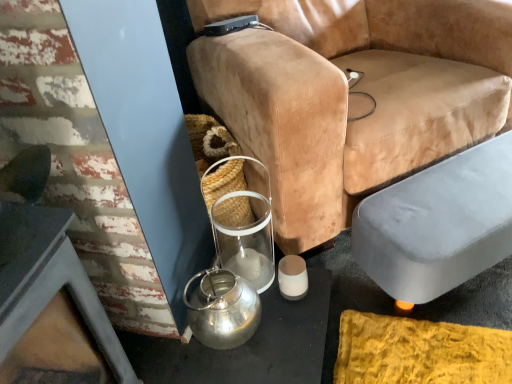
Where is `free spot above gray fabric ottoman at lower right (from a real-world perspective)`? Image resolution: width=512 pixels, height=384 pixels. free spot above gray fabric ottoman at lower right (from a real-world perspective) is located at coordinates (453, 194).